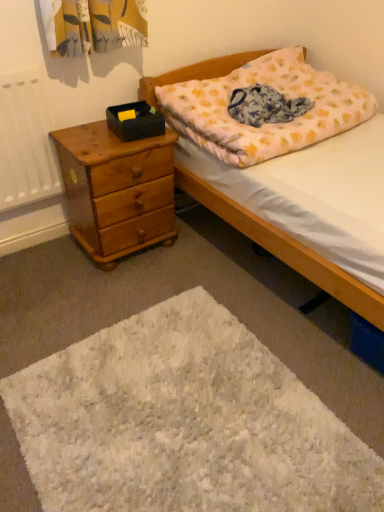
The height and width of the screenshot is (512, 384). What are the coordinates of `free space on the front side of light brown wooden chest of drawers at left` in the screenshot? It's located at (102, 288).